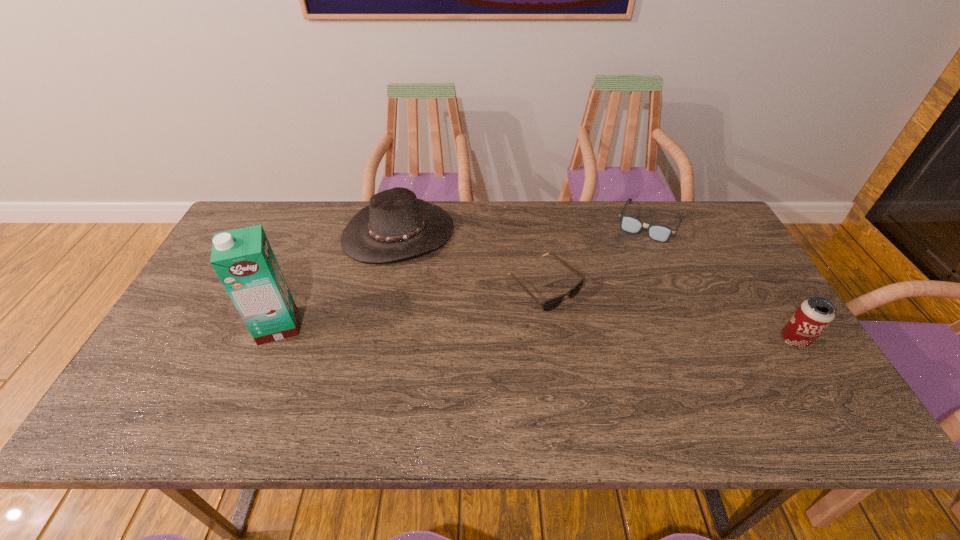
Where is `free area in between the fourth object from right to left and the spectacles`? The height and width of the screenshot is (540, 960). free area in between the fourth object from right to left and the spectacles is located at coordinates (524, 227).

Locate an element on the screen. This screenshot has width=960, height=540. empty location between the hat and the sunglasses is located at coordinates (471, 259).

Locate an element on the screen. This screenshot has height=540, width=960. free point between the second object from left to right and the second shortest object is located at coordinates (524, 227).

Identify the location of free spot between the spectacles and the tallest object. (464, 274).

The width and height of the screenshot is (960, 540). Identify the location of empty space between the carton and the third object from right to left. (411, 306).

The width and height of the screenshot is (960, 540). Identify the location of free spot between the beer can and the shortest object. (669, 313).

Find the location of a particular element. This screenshot has height=540, width=960. vacant space in between the spectacles and the second object from left to right is located at coordinates (524, 227).

At what (x,y) coordinates should I click in order to perform the action: click on blank region between the shortest object and the carton. Please return your answer as a coordinate pair (x, y). Image resolution: width=960 pixels, height=540 pixels. Looking at the image, I should click on (411, 306).

The height and width of the screenshot is (540, 960). I want to click on vacant space that is in between the beer can and the second object from left to right, so click(x=596, y=287).

I want to click on vacant point located between the fourth object from right to left and the rightmost object, so click(x=596, y=287).